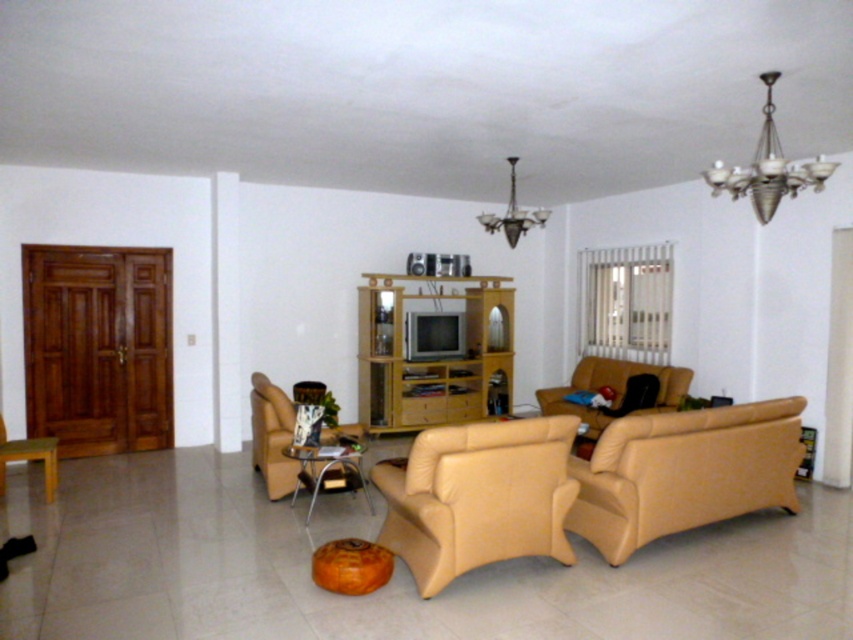
Question: Which point is farther to the camera?

Choices:
 (A) (434, 540)
 (B) (585, 362)
 (C) (546, 212)
 (D) (30, 442)

Answer: (B)

Question: Can you confirm if beige leather armchair at center is positioned above wooden chair at lower left?

Choices:
 (A) yes
 (B) no

Answer: (A)

Question: Which is farther from the beige leather couch at center?

Choices:
 (A) wooden chair at lower left
 (B) leather couch at center
 (C) beige leather chair at lower left

Answer: (A)

Question: Is beige leather chair at lower left to the right of wooden chair at lower left from the viewer's perspective?

Choices:
 (A) no
 (B) yes

Answer: (B)

Question: Is beige leather couch at center above wooden chair at lower left?

Choices:
 (A) no
 (B) yes

Answer: (B)

Question: Estimate the real-world distances between objects in this image. Which object is closer to the beige leather armchair at center?

Choices:
 (A) leather couch at center
 (B) beige leather chair at lower left
 (C) metallic silver chandelier at upper right

Answer: (A)